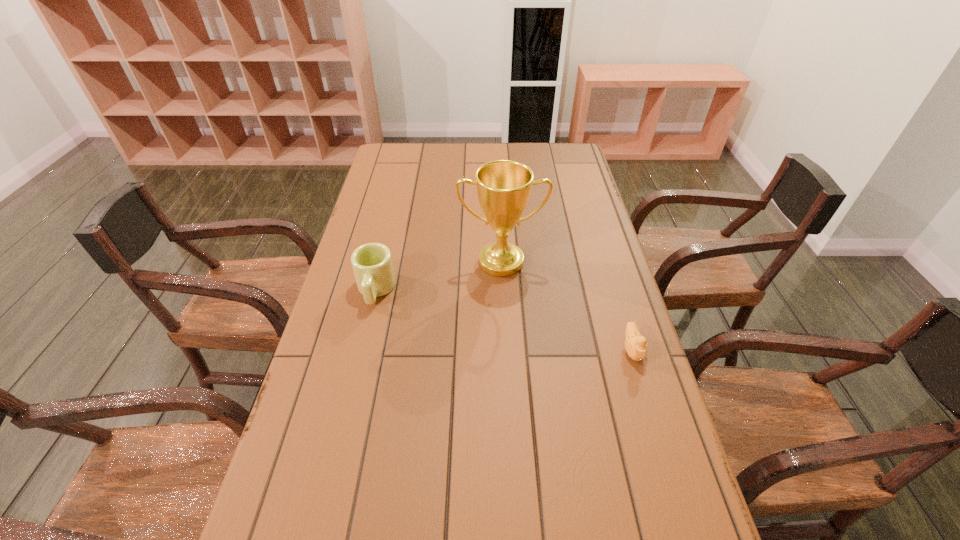
The height and width of the screenshot is (540, 960). I want to click on object situated at the right edge, so click(635, 344).

The width and height of the screenshot is (960, 540). In the image, there is a desktop. Identify the location of free space at the far edge. [484, 142].

In order to click on vacant space at the left edge of the desktop in this screenshot , I will do `click(378, 302)`.

Locate an element on the screen. The width and height of the screenshot is (960, 540). free space at the right edge is located at coordinates (657, 418).

Where is `vacant space at the far left corner of the desktop`? vacant space at the far left corner of the desktop is located at coordinates (406, 150).

Find the location of a particular element. vacant space at the far right corner is located at coordinates (571, 154).

At what (x,y) coordinates should I click in order to perform the action: click on free space between the rightmost object and the tallest object. Please return your answer as a coordinate pair (x, y). Looking at the image, I should click on (566, 306).

At what (x,y) coordinates should I click in order to perform the action: click on blank region between the leftmost object and the tallest object. Please return your answer as a coordinate pair (x, y). The image size is (960, 540). Looking at the image, I should click on (438, 276).

Locate an element on the screen. vacant space that is in between the duckling and the second shortest object is located at coordinates (504, 320).

Where is `free space between the rightmost object and the award`? The image size is (960, 540). free space between the rightmost object and the award is located at coordinates (566, 306).